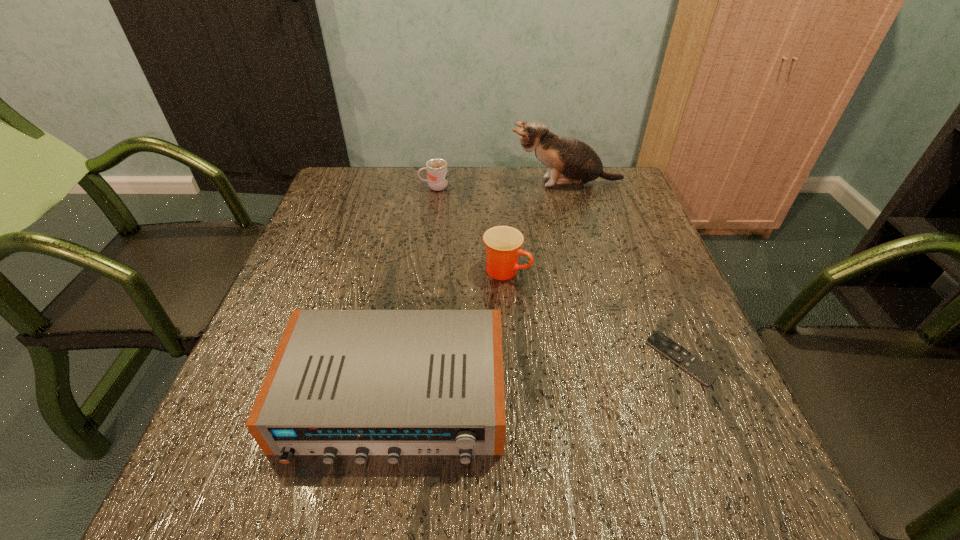
The image size is (960, 540). What are the coordinates of `the tallest object` in the screenshot? It's located at (570, 162).

In order to click on the left cup in this screenshot , I will do `click(437, 175)`.

You are a GUI agent. You are given a task and a screenshot of the screen. Output one action in this format:
    pyautogui.click(x=<x>, y=<y>)
    Task: Click on the right cup
    Image resolution: width=960 pixels, height=540 pixels.
    Given the screenshot: What is the action you would take?
    503,243

At what (x,y) coordinates should I click in order to perform the action: click on the nearer cup. Please return your answer as a coordinate pair (x, y). The height and width of the screenshot is (540, 960). Looking at the image, I should click on (503, 243).

At what (x,y) coordinates should I click in order to perform the action: click on radio receiver. Please return your answer as a coordinate pair (x, y). This screenshot has height=540, width=960. Looking at the image, I should click on (342, 382).

Find the location of a particular element. the shortest object is located at coordinates (697, 368).

At what (x,y) coordinates should I click in order to perform the action: click on vacant space positioned at the face of the tallest object. Please return your answer as a coordinate pair (x, y). Looking at the image, I should click on (393, 183).

Locate an element on the screen. The height and width of the screenshot is (540, 960). vacant space situated 0.220m at the face of the tallest object is located at coordinates (436, 183).

This screenshot has width=960, height=540. I want to click on blank area located 0.050m at the face of the tallest object, so click(492, 183).

This screenshot has height=540, width=960. I want to click on free space located on the side with the handle of the farther cup, so click(355, 187).